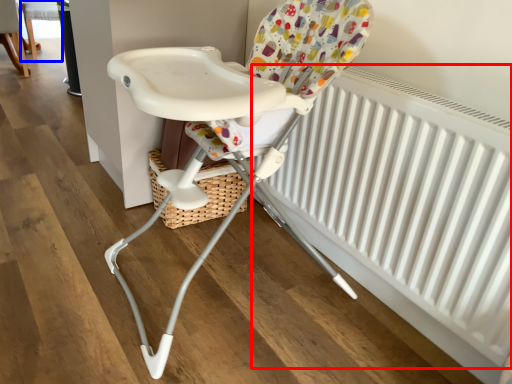
Question: Which object appears farthest to the camera in this image, radiator (highlighted by a red box) or chair (highlighted by a blue box)?

Choices:
 (A) radiator
 (B) chair

Answer: (B)